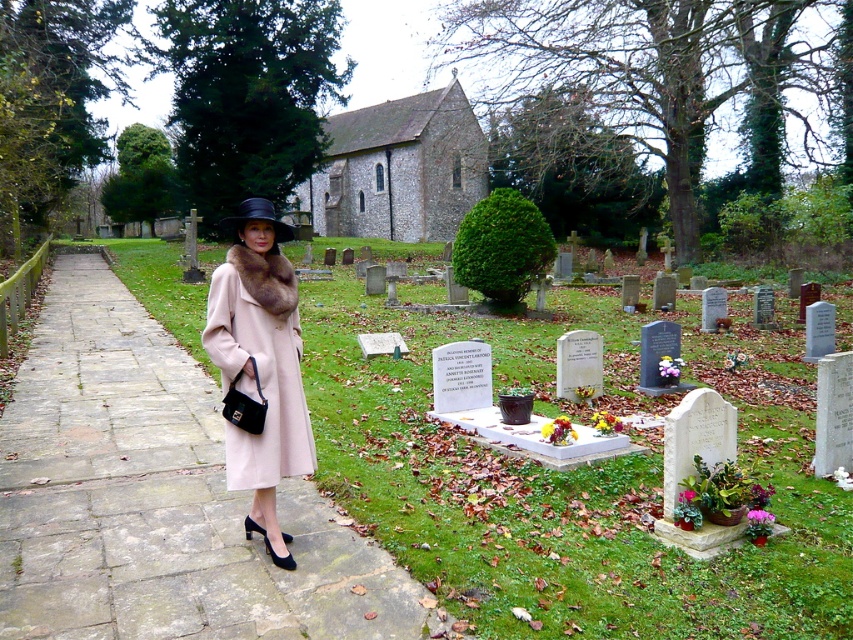
You are a photographer positioned at the cemetery entrance. You want to capture a photo of the matte pink coat at center and the black felt hat at center such that both are in focus. Given that your camera has a depth of field that can sharply focus objects within a 3.5 meter range, will you be able to achieve this?

The matte pink coat at center and the black felt hat at center are 3.72 meters apart, which exceeds the camera depth of field range of 3.5 meters. Therefore, both objects cannot be in focus simultaneously in the photo.

You are a tailor measuring the clothing items in the scene. The matte pink coat at center and the black felt hat at center are both in need of alterations. Which item has a smaller width that requires adjustments?

The matte pink coat at center has a smaller width than the black felt hat at center, so it requires adjustments for its narrower dimensions.